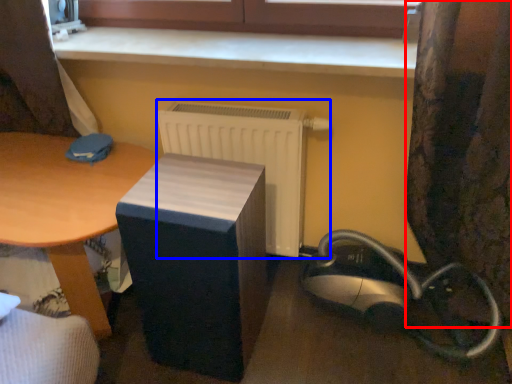
Question: Which of the following is the farthest to the observer, curtain (highlighted by a red box) or radiator (highlighted by a blue box)?

Choices:
 (A) curtain
 (B) radiator

Answer: (B)